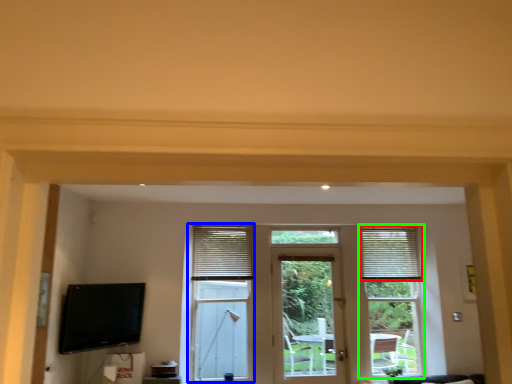
Question: Based on their relative distances, which object is nearer to window blind (highlighted by a red box)? Choose from bay window (highlighted by a blue box) and window frame (highlighted by a green box).

Choices:
 (A) bay window
 (B) window frame

Answer: (B)